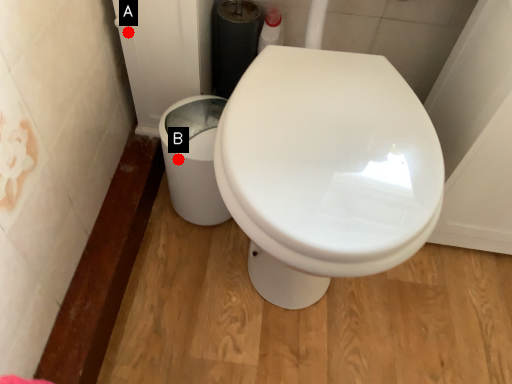
Question: Two points are circled on the image, labeled by A and B beside each circle. Among these points, which one is nearest to the camera?

Choices:
 (A) A is closer
 (B) B is closer

Answer: (B)